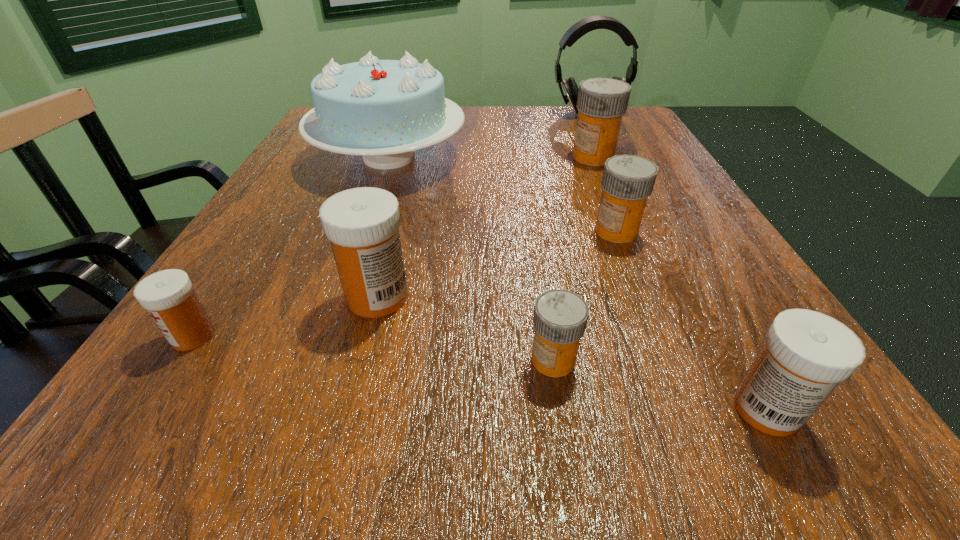
At what (x,y) coordinates should I click in order to perform the action: click on free region located 0.100m on the back of the biggest white medicine. Please return your answer as a coordinate pair (x, y). This screenshot has height=540, width=960. Looking at the image, I should click on (393, 237).

At what (x,y) coordinates should I click in order to perform the action: click on vacant region located 0.280m on the label side of the fifth nearest medicine. Please return your answer as a coordinate pair (x, y). The height and width of the screenshot is (540, 960). Looking at the image, I should click on (428, 231).

The width and height of the screenshot is (960, 540). I want to click on free space located on the label side of the fifth nearest medicine, so click(451, 231).

Locate an element on the screen. vacant region located 0.240m on the label side of the fifth nearest medicine is located at coordinates (451, 231).

At what (x,y) coordinates should I click in order to perform the action: click on blank space located 0.120m on the back of the nearest object. Please return your answer as a coordinate pair (x, y). Looking at the image, I should click on (710, 309).

Where is `free space located 0.230m on the back of the leftmost white medicine`? The image size is (960, 540). free space located 0.230m on the back of the leftmost white medicine is located at coordinates (266, 224).

This screenshot has width=960, height=540. I want to click on free location located on the label side of the third medicine from left to right, so click(x=456, y=360).

At what (x,y) coordinates should I click in order to perform the action: click on free point located 0.090m on the label side of the third medicine from left to right. Please return your answer as a coordinate pair (x, y). This screenshot has width=960, height=540. Looking at the image, I should click on (456, 360).

Where is `vacant space located on the label side of the third medicine from left to right`? vacant space located on the label side of the third medicine from left to right is located at coordinates (383, 360).

This screenshot has width=960, height=540. Identify the location of earphone at the far edge. (591, 23).